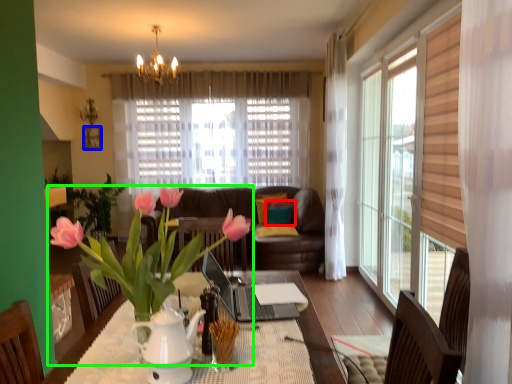
Question: Which is farther away from pillow (highlighted by a red box)? picture frame (highlighted by a blue box) or houseplant (highlighted by a green box)?

Choices:
 (A) picture frame
 (B) houseplant

Answer: (B)